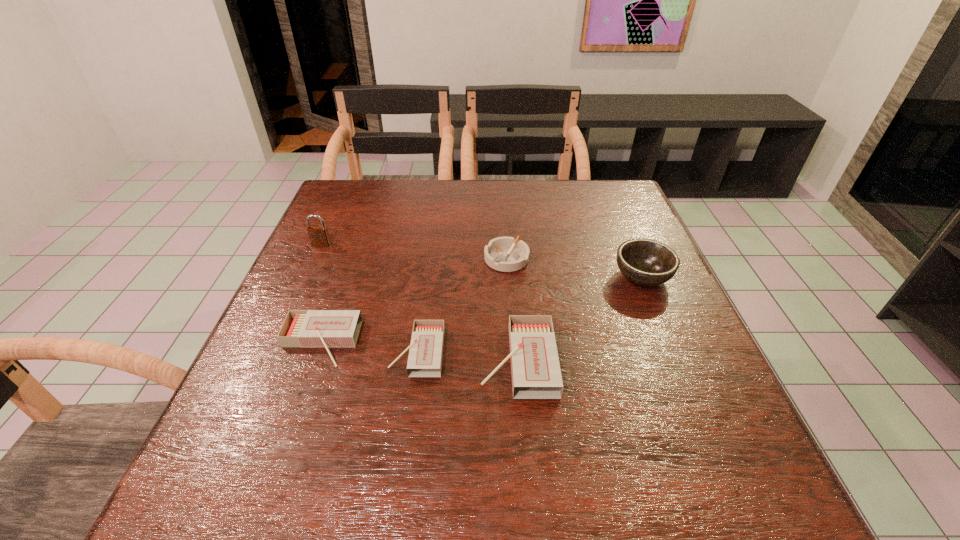
You are a GUI agent. You are given a task and a screenshot of the screen. Output one action in this format:
    pyautogui.click(x=<x>, y=<y>)
    Task: Click on the matchbox that is at the left edge
    Image resolution: width=960 pixels, height=540 pixels.
    Given the screenshot: What is the action you would take?
    pyautogui.click(x=301, y=328)

This screenshot has height=540, width=960. I want to click on padlock positioned at the left edge, so click(x=319, y=237).

Locate an element on the screen. This screenshot has height=540, width=960. object that is at the right edge is located at coordinates (646, 262).

In order to click on vacant space at the far edge of the desktop in this screenshot , I will do `click(492, 199)`.

Where is `vacant area at the near edge`? Image resolution: width=960 pixels, height=540 pixels. vacant area at the near edge is located at coordinates (568, 422).

The height and width of the screenshot is (540, 960). What are the coordinates of `free spot at the left edge of the desktop` in the screenshot? It's located at (315, 390).

Locate an element on the screen. The width and height of the screenshot is (960, 540). blank area at the right edge is located at coordinates (606, 250).

I want to click on blank space at the far left corner, so click(x=356, y=183).

Locate an element on the screen. The width and height of the screenshot is (960, 540). free space between the leftmost matchbox and the bowl is located at coordinates (481, 310).

Identify the location of empty location between the ashtray and the second shortest matchbox. (413, 301).